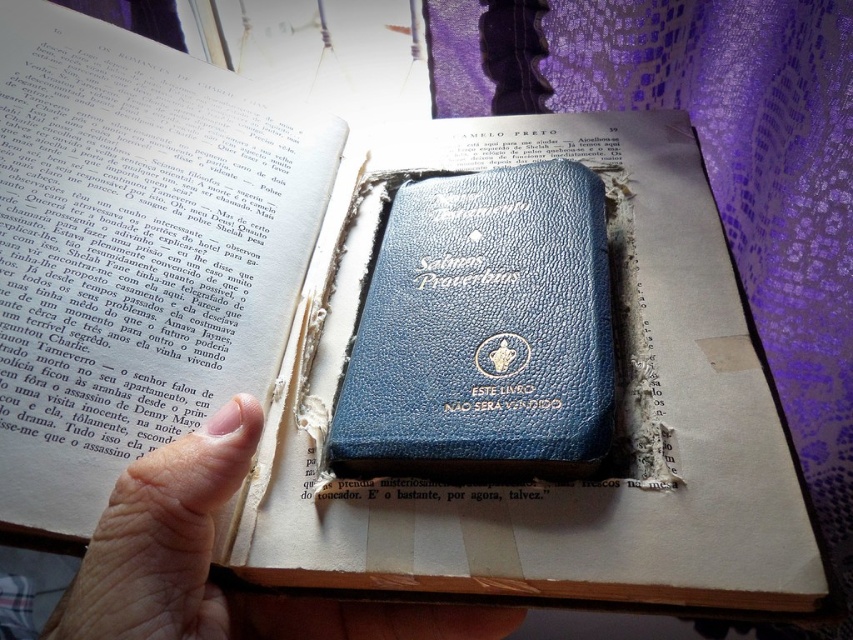
Can you confirm if blue leather book at center is shorter than skinny flesh hand at center?

In fact, blue leather book at center may be taller than skinny flesh hand at center.

Can you confirm if blue leather book at center is bigger than skinny flesh hand at center?

Indeed, blue leather book at center has a larger size compared to skinny flesh hand at center.

The height and width of the screenshot is (640, 853). Describe the element at coordinates (483, 332) in the screenshot. I see `blue leather book at center` at that location.

Locate an element on the screen. The height and width of the screenshot is (640, 853). blue leather book at center is located at coordinates (483, 332).